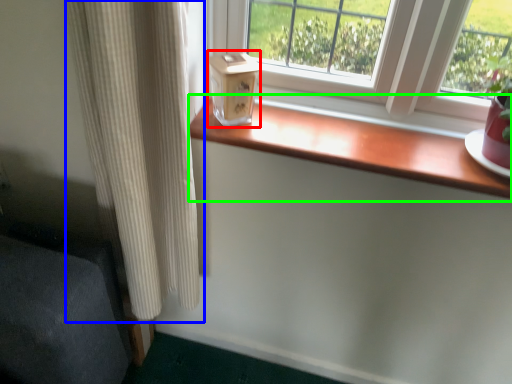
Question: Which object is the farthest from window box (highlighted by a red box)? Choose among these: curtain (highlighted by a blue box) or window sill (highlighted by a green box).

Choices:
 (A) curtain
 (B) window sill

Answer: (A)